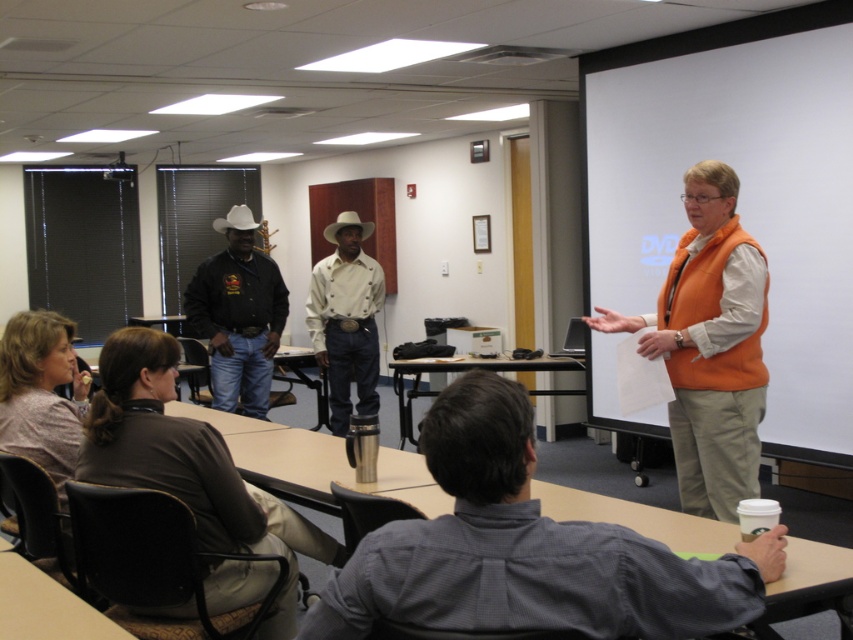
Question: Is black leather jacket at center above beige cotton shirt at center?

Choices:
 (A) yes
 (B) no

Answer: (A)

Question: Estimate the real-world distances between objects in this image. Which object is closer to the dark brown leather jacket at lower left?

Choices:
 (A) gray checkered shirt at center
 (B) patterned fabric shirt at lower left
 (C) black leather jacket at center

Answer: (B)

Question: Does dark brown leather jacket at lower left appear over patterned fabric shirt at lower left?

Choices:
 (A) no
 (B) yes

Answer: (A)

Question: Which is farther from the dark brown leather jacket at lower left?

Choices:
 (A) gray checkered shirt at center
 (B) black leather jacket at center
 (C) patterned fabric shirt at lower left

Answer: (B)

Question: Is gray checkered shirt at center smaller than patterned fabric shirt at lower left?

Choices:
 (A) yes
 (B) no

Answer: (B)

Question: Which point is farther from the camera taking this photo?

Choices:
 (A) 399,579
 (B) 3,416

Answer: (B)